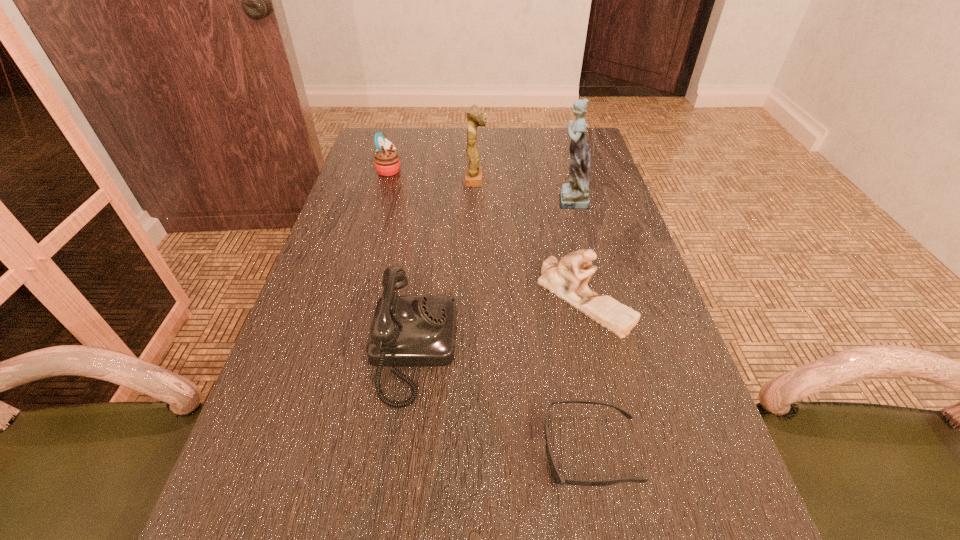
Find the location of a particular element. This screenshot has width=960, height=540. object located at the left edge is located at coordinates (386, 160).

The width and height of the screenshot is (960, 540). Find the location of `sunglasses present at the right edge`. sunglasses present at the right edge is located at coordinates [558, 479].

The image size is (960, 540). Find the location of `object that is at the far left corner`. object that is at the far left corner is located at coordinates (386, 160).

In the image, there is a desktop. In order to click on blank space at the far edge in this screenshot , I will do `click(458, 131)`.

Where is `free space at the left edge of the desktop`? This screenshot has width=960, height=540. free space at the left edge of the desktop is located at coordinates (266, 488).

The height and width of the screenshot is (540, 960). What are the coordinates of `vacant space at the right edge of the desktop` in the screenshot? It's located at click(x=580, y=222).

At what (x,y) coordinates should I click in order to perform the action: click on vacant region at the far right corner of the desktop. Please return your answer as a coordinate pair (x, y). The image size is (960, 540). Looking at the image, I should click on (550, 134).

Image resolution: width=960 pixels, height=540 pixels. Find the location of `vacant space that is in between the shortest figurine and the second farthest figurine`. vacant space that is in between the shortest figurine and the second farthest figurine is located at coordinates (577, 249).

Find the location of a particular element. vacant region between the telephone and the nearest figurine is located at coordinates (499, 324).

This screenshot has width=960, height=540. In order to click on unoccupied area between the tallest object and the nearest object in this screenshot , I will do `click(580, 325)`.